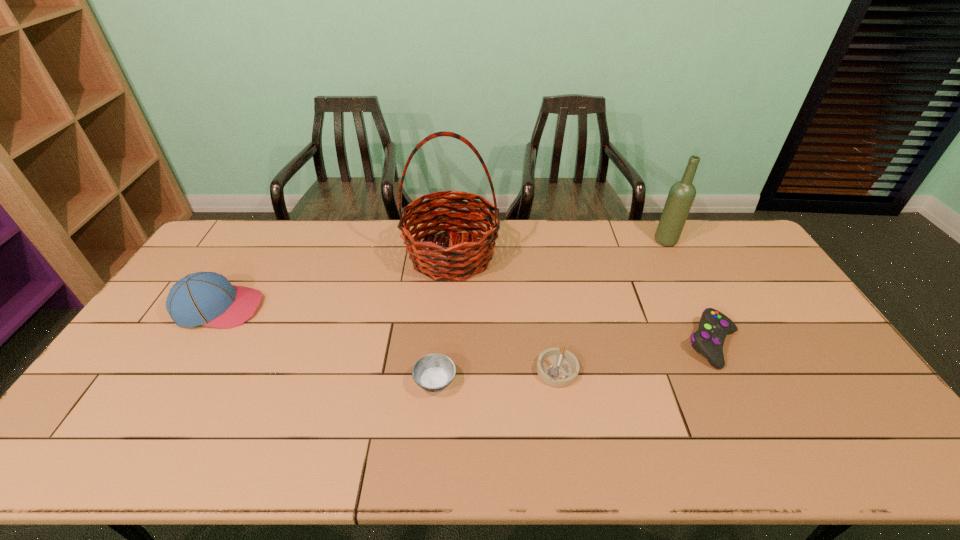
Where is `vacant space at the left edge of the desktop`? vacant space at the left edge of the desktop is located at coordinates (x=152, y=346).

Locate an element on the screen. The image size is (960, 540). vacant region at the right edge of the desktop is located at coordinates (741, 300).

In the image, there is a desktop. Identify the location of free space at the near right corner. The width and height of the screenshot is (960, 540). (831, 449).

Where is `vacant region between the tallest object and the baseball cap`? The width and height of the screenshot is (960, 540). vacant region between the tallest object and the baseball cap is located at coordinates (335, 281).

You are a GUI agent. You are given a task and a screenshot of the screen. Output one action in this format:
    pyautogui.click(x=<x>, y=<y>)
    Task: Click on the vacant area that lies between the shorter ashtray and the tallest object
    The height and width of the screenshot is (540, 960).
    Given the screenshot: What is the action you would take?
    pyautogui.click(x=504, y=313)

This screenshot has width=960, height=540. What are the coordinates of `unoccupied position between the second tallest object and the third object from right to left` in the screenshot? It's located at (612, 306).

You are a GUI agent. You are given a task and a screenshot of the screen. Output one action in this format:
    pyautogui.click(x=<x>, y=<y>)
    Task: Click on the vacant point located between the basket and the shorter ashtray
    
    Given the screenshot: What is the action you would take?
    tap(504, 313)

I want to click on vacant space in between the fourth tallest object and the basket, so click(x=583, y=300).

I want to click on blank region between the right ashtray and the left ashtray, so click(496, 376).

Where is `vacant space that's between the control and the baseball cap`? Image resolution: width=960 pixels, height=540 pixels. vacant space that's between the control and the baseball cap is located at coordinates (467, 326).